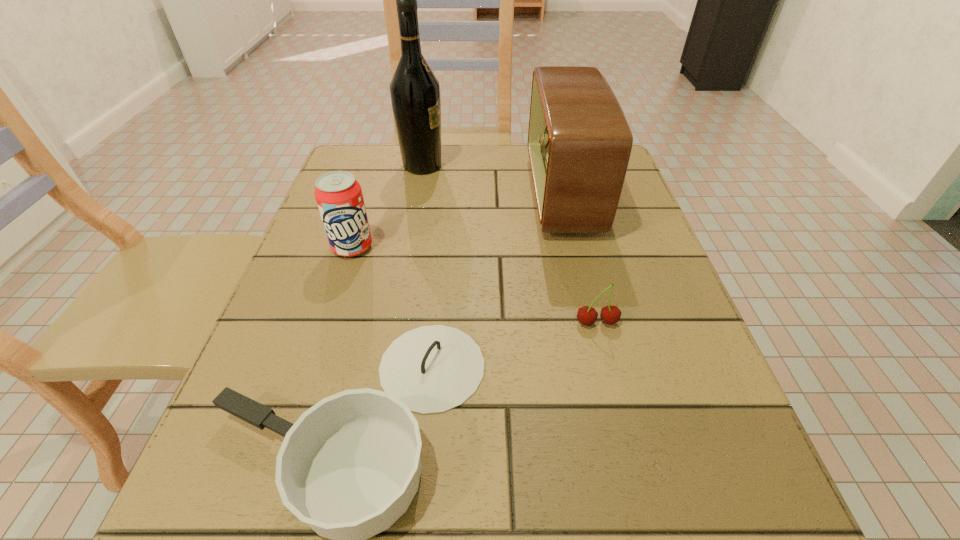
This screenshot has width=960, height=540. I want to click on free space between the soda can and the tallest object, so click(387, 206).

At what (x,y) coordinates should I click in order to perform the action: click on object that stands as the fourth closest to the radio receiver. Please return your answer as a coordinate pair (x, y). This screenshot has height=540, width=960. Looking at the image, I should click on (x=338, y=194).

This screenshot has height=540, width=960. Identify the location of the third closest object relative to the radio receiver. (349, 467).

This screenshot has width=960, height=540. In order to click on vacant space that satisfies the following two spatial constraints: 1. on the front-facing side of the second tallest object; 2. on the surface of the third tallest object in this screenshot , I will do `click(574, 247)`.

The width and height of the screenshot is (960, 540). What are the coordinates of `free space that satisfies the following two spatial constraints: 1. on the label of the wine bottle; 2. on the surface of the soda can` in the screenshot? It's located at (408, 247).

The image size is (960, 540). I want to click on vacant region that satisfies the following two spatial constraints: 1. on the label of the wine bottle; 2. on the surface of the third tallest object, so click(x=408, y=247).

This screenshot has height=540, width=960. Identify the location of vacant space that satisfies the following two spatial constraints: 1. on the label of the wine bottle; 2. on the surface of the soda can. (x=408, y=247).